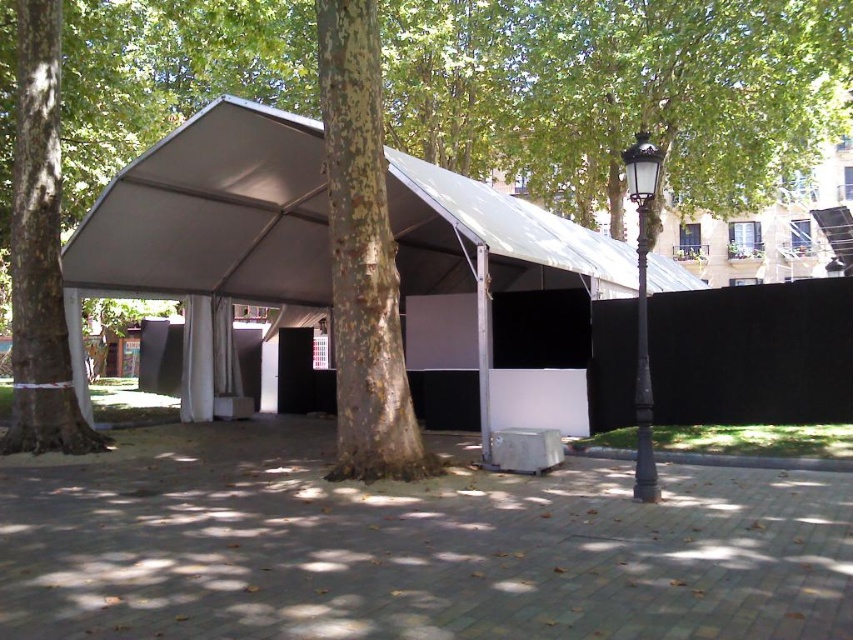
Question: From the image, what is the correct spatial relationship of white fabric tent at center in relation to green leafy tree at center?

Choices:
 (A) above
 (B) below

Answer: (A)

Question: Which point is farther from the camera taking this photo?

Choices:
 (A) (51, 234)
 (B) (126, 196)

Answer: (B)

Question: Is white fabric tent at center to the left of green leafy tree at center from the viewer's perspective?

Choices:
 (A) no
 (B) yes

Answer: (A)

Question: Does white fabric tent at center have a lesser width compared to green leafy tree at center?

Choices:
 (A) yes
 (B) no

Answer: (B)